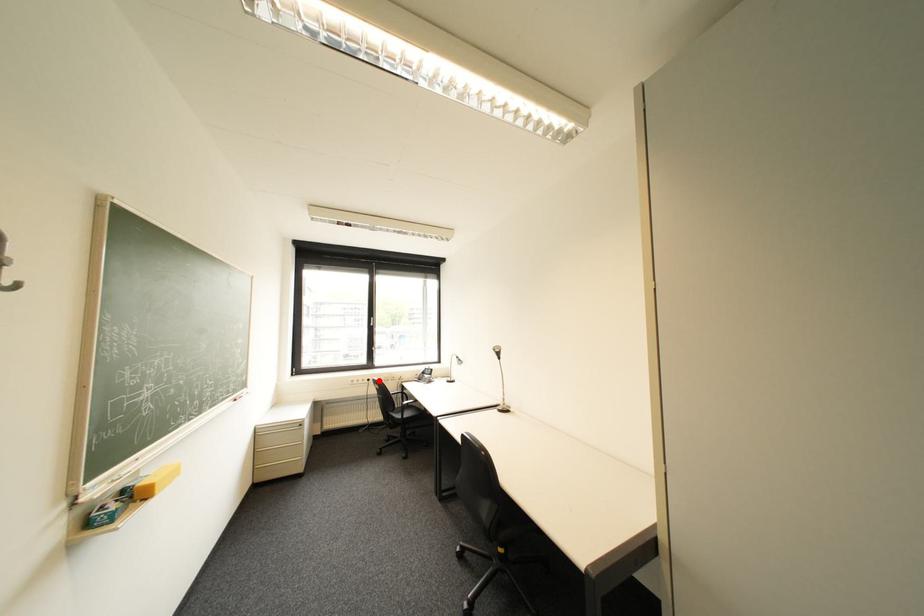
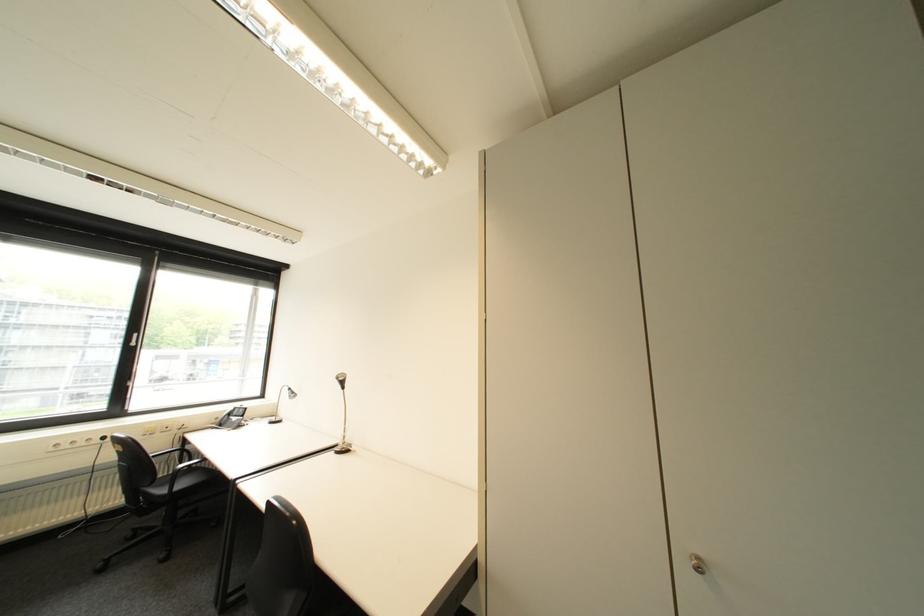
Where in the second image is the point corresponding to the highlighted location from the first image?

(114, 439)